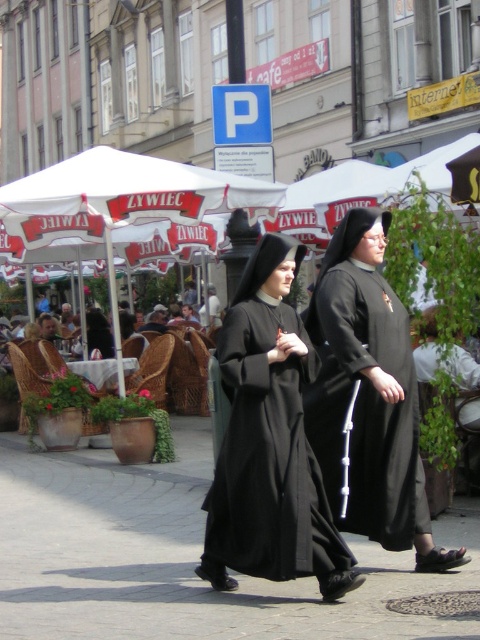
Question: Which of the following is the farthest from the observer?

Choices:
 (A) black matte dress at center
 (B) dark brown leather jacket at center

Answer: (B)

Question: Does black matte dress at center have a greater width compared to dark brown leather jacket at center?

Choices:
 (A) no
 (B) yes

Answer: (B)

Question: Is the position of black matte nun's habit at center less distant than that of matte black nun at center?

Choices:
 (A) no
 (B) yes

Answer: (B)

Question: Can you confirm if black matte dress at center is thinner than dark brown leather jacket at center?

Choices:
 (A) yes
 (B) no

Answer: (B)

Question: Which of the following is the closest to the observer?

Choices:
 (A) (112, 346)
 (B) (340, 493)
 (C) (269, 490)

Answer: (C)

Question: Among these points, which one is farthest from the camera?

Choices:
 (A) (211, 289)
 (B) (332, 416)
 (C) (108, 323)

Answer: (A)